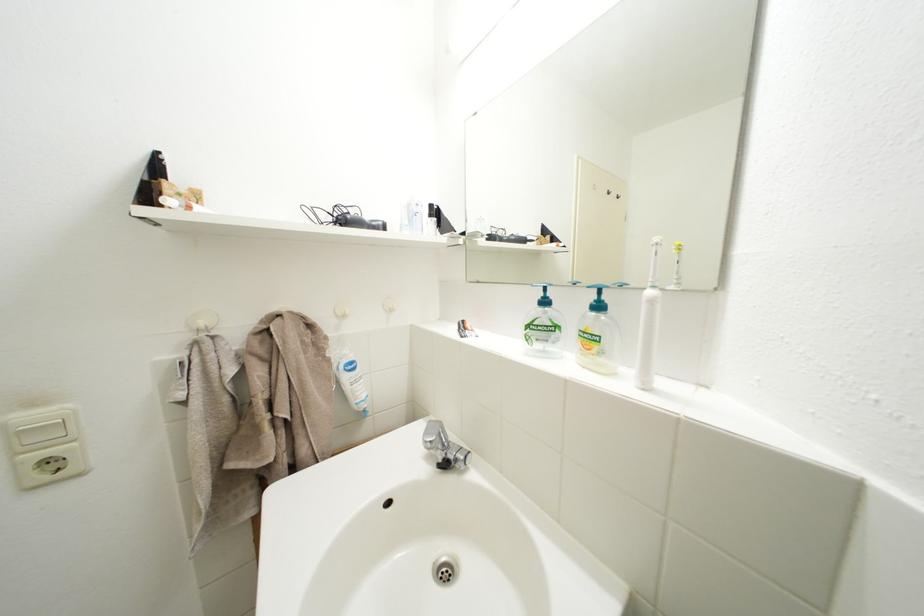
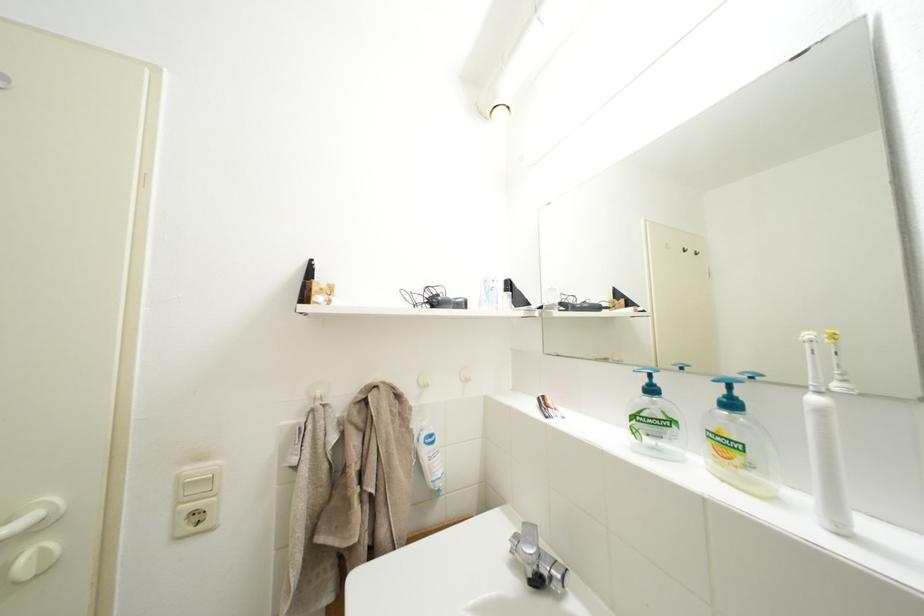
Which direction would the cameraman need to move to produce the second image?

The cameraman moved toward left, backward.